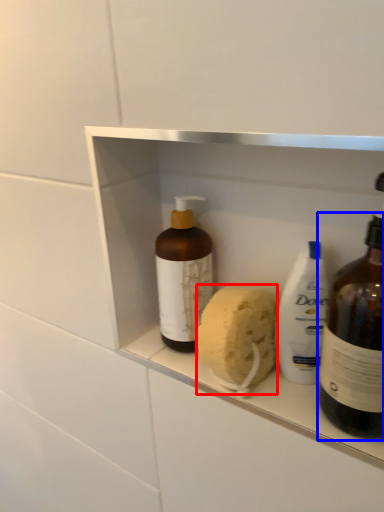
Question: Which object appears farthest to the camera in this image, soap (highlighted by a red box) or bottle (highlighted by a blue box)?

Choices:
 (A) soap
 (B) bottle

Answer: (A)